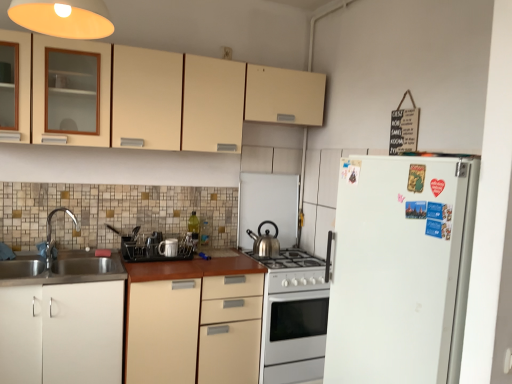
Locate an element on the screen. The image size is (512, 384). vacant space to the right of polished stainless steel kettle at center is located at coordinates (291, 256).